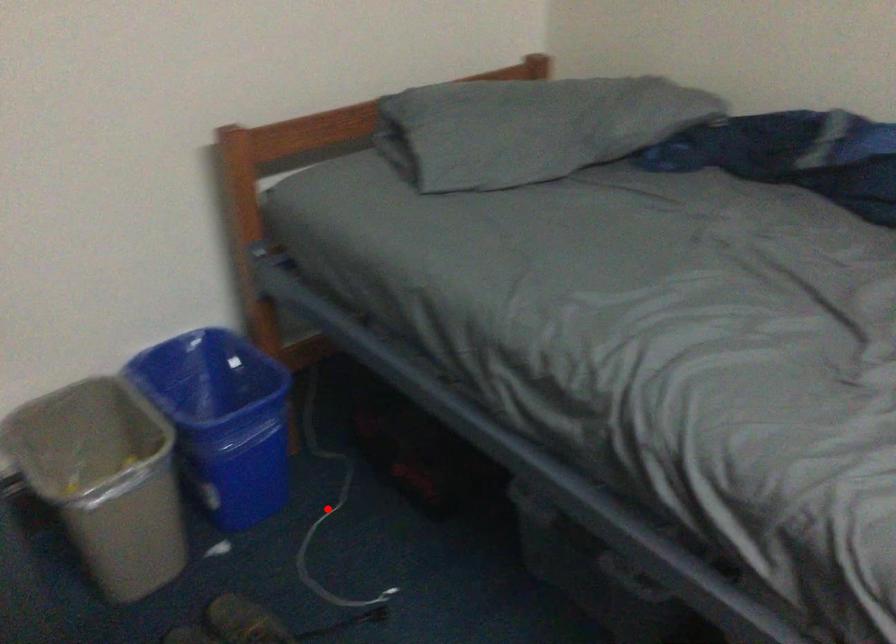
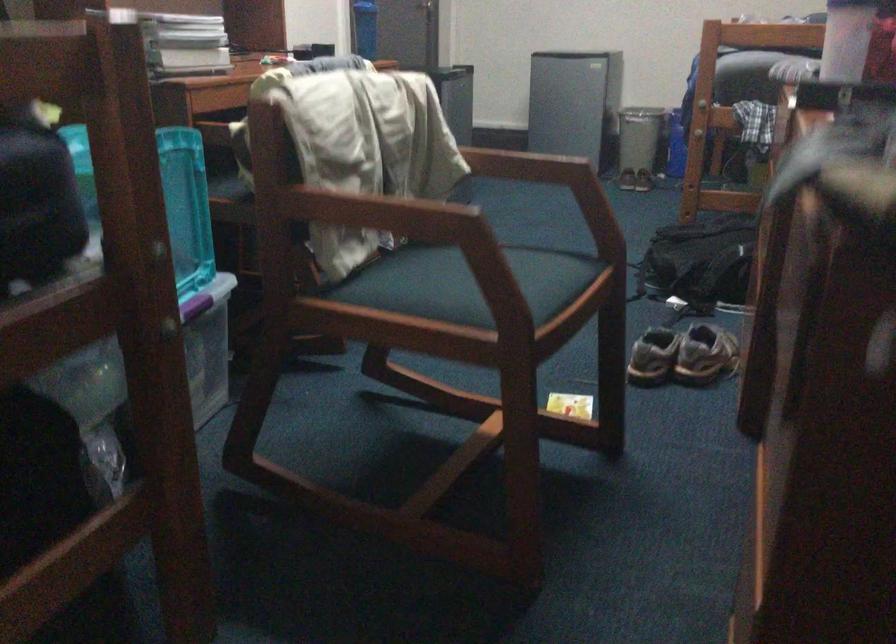
Question: I am providing you with two images of the same scene from different viewpoints. A red point is marked on the first image. Is the red point's position out of view in image 2?

Choices:
 (A) Yes
 (B) No

Answer: (A)